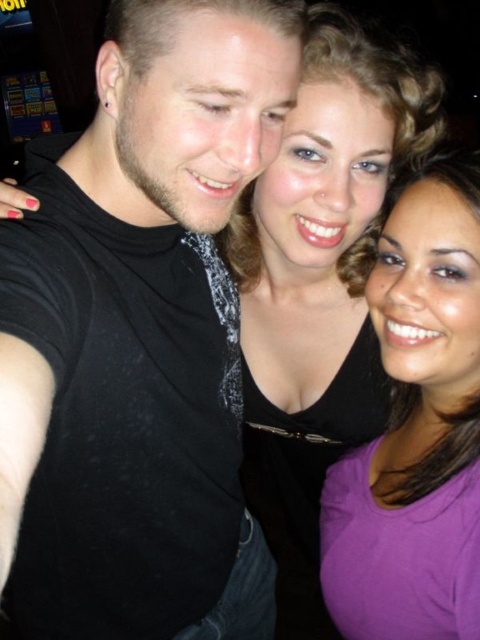
You are taking a photo of three people standing in a line. You notice two points in the image labeled as point 1 and point 2. The first point is at position [70,390] and the second point is at [364,182]. Based on their positions, which point is closer to the camera?

Point 1 at position [70,390] is closer to the camera than point 2 at [364,182].

What is located at the coordinates point (141,339)?

The black matte shirt at left is located at point (141,339).

You are trying to arrange the black matte shirt at left and the purple matte shirt at center on a shelf. If the shelf has limited vertical space, which shirt should be placed on top to ensure they both fit?

The black matte shirt at left should be placed below the purple matte shirt at center since it is located below in the image, so placing the purple one on top would maintain their original positions and ensure they both fit on the shelf.